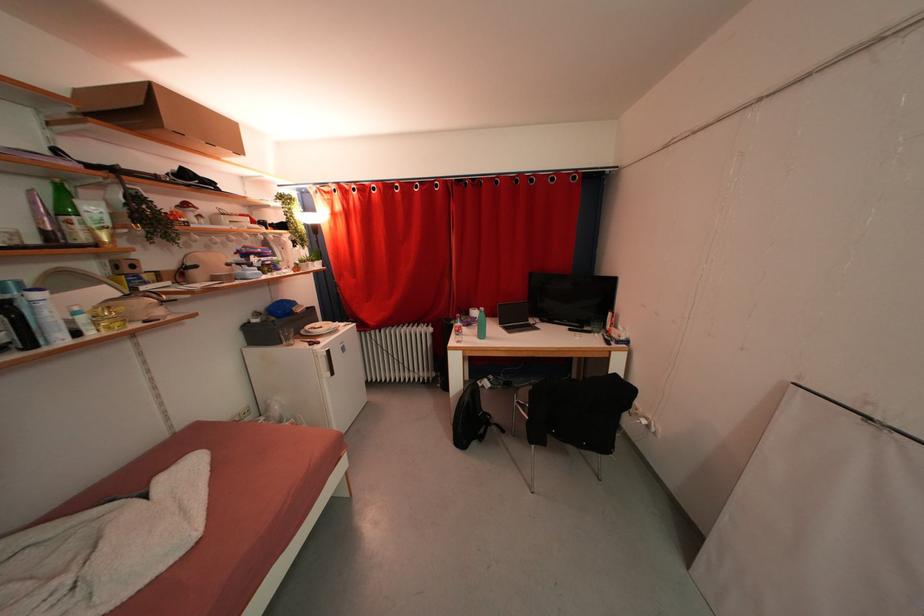
The image size is (924, 616). In order to click on blue plastic bottle in this screenshot , I will do `click(480, 323)`.